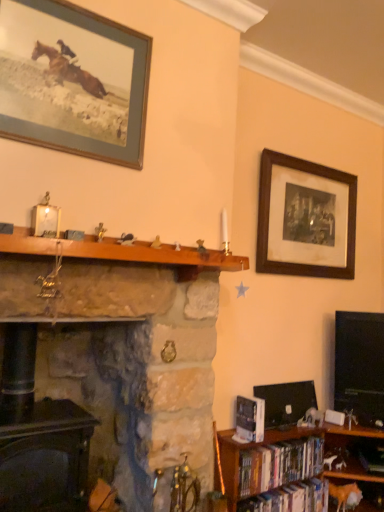
The height and width of the screenshot is (512, 384). I want to click on empty space that is ontop of dark wood fireplace at lower left, positioned as the second fireplace in right-to-left order, so click(30, 410).